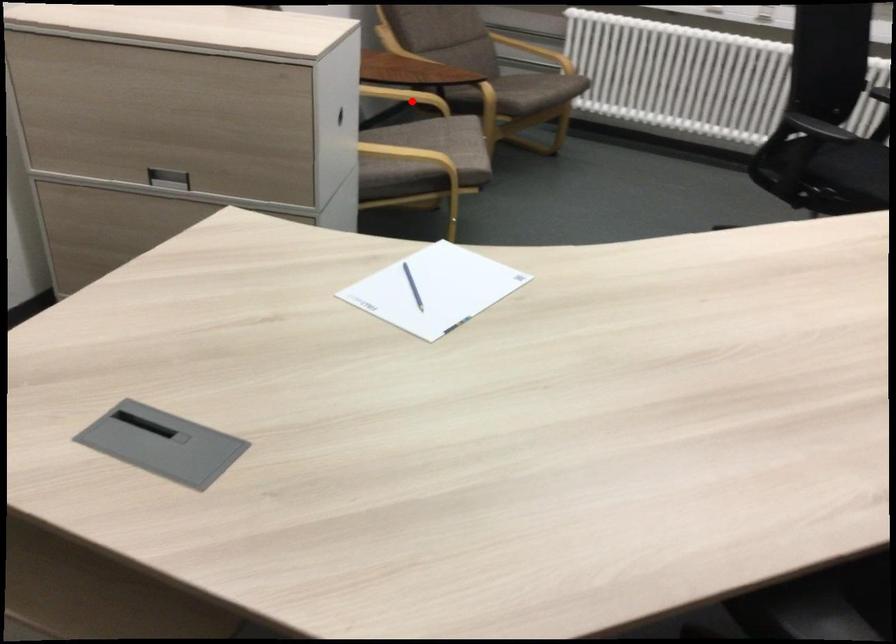
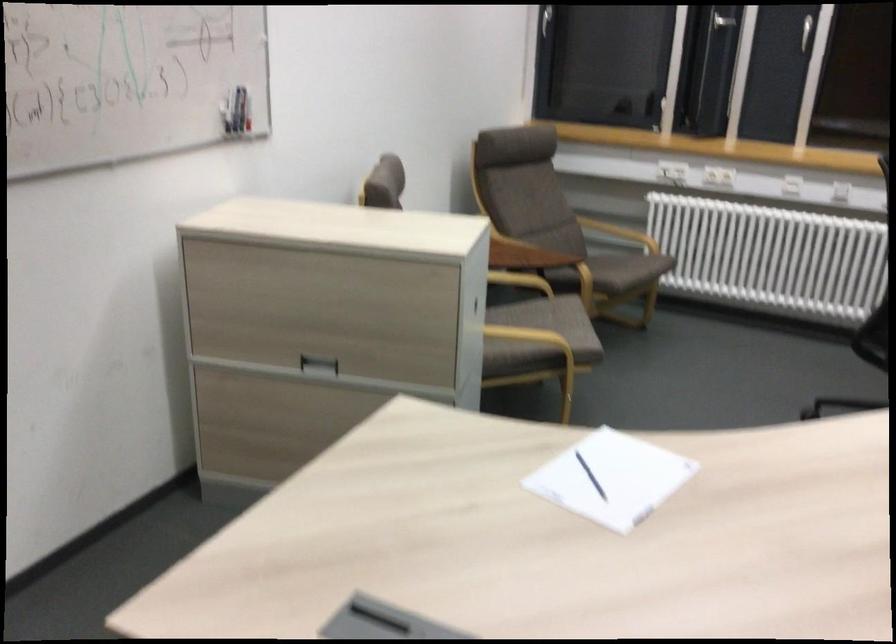
The point at the highlighted location is marked in the first image. Where is the corresponding point in the second image?

(520, 279)